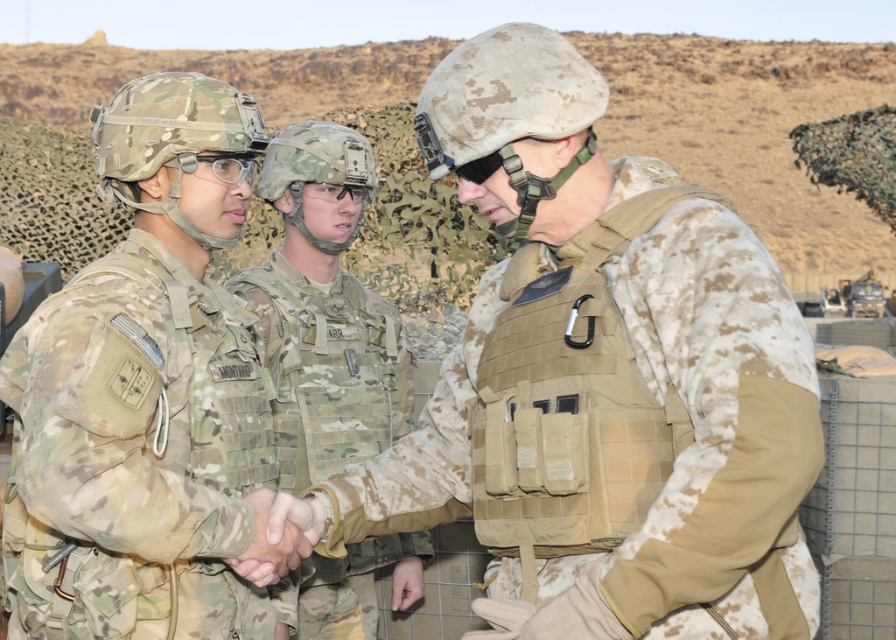
Question: Which point is farther to the camera?

Choices:
 (A) camouflage fabric vest at center
 (B) multicam fabric uniform at center

Answer: (B)

Question: Which of the following is the closest to the observer?

Choices:
 (A) multicam fabric uniform at center
 (B) camouflage fabric uniform at center

Answer: (B)

Question: Which point is farther to the camera?

Choices:
 (A) multicam fabric uniform at center
 (B) camouflage fabric uniform at center

Answer: (A)

Question: Is camouflage fabric vest at center bigger than multicam fabric uniform at center?

Choices:
 (A) yes
 (B) no

Answer: (A)

Question: Is camouflage fabric vest at center positioned before camouflage fabric uniform at center?

Choices:
 (A) yes
 (B) no

Answer: (A)

Question: Is camouflage fabric uniform at center below multicam fabric uniform at center?

Choices:
 (A) no
 (B) yes

Answer: (A)